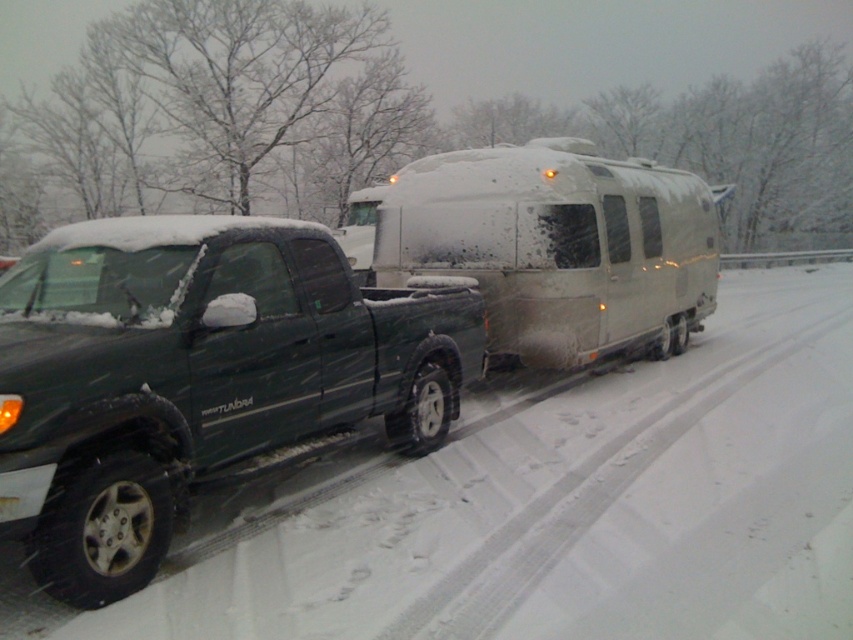
Between matte black truck at left and white matte trailer at center, which one appears on the left side from the viewer's perspective?

matte black truck at left is more to the left.

Which of these two, matte black truck at left or white matte trailer at center, stands shorter?

matte black truck at left is shorter.

Between point (13, 333) and point (677, 268), which one is positioned behind?

The point (677, 268) is more distant.

You are a GUI agent. You are given a task and a screenshot of the screen. Output one action in this format:
    pyautogui.click(x=<x>, y=<y>)
    Task: Click on the matte black truck at left
    Image resolution: width=853 pixels, height=640 pixels.
    Given the screenshot: What is the action you would take?
    pyautogui.click(x=198, y=376)